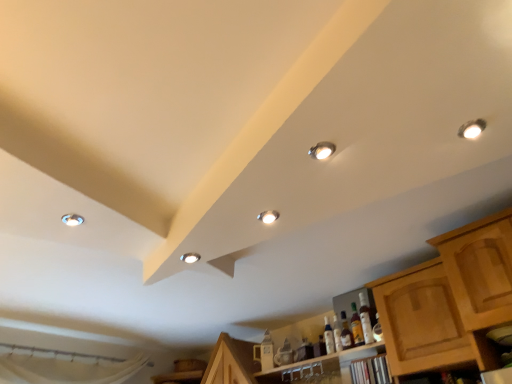
Locate an element on the screen. Image resolution: width=512 pixels, height=384 pixels. matte silver droplight at center, which is the second droplight in top-to-bottom order is located at coordinates (268, 216).

What do you see at coordinates (472, 129) in the screenshot?
I see `matte silver droplight at upper right, the first droplight from the front` at bounding box center [472, 129].

Measure the distance between wooden cabinet at lower right and camera.

wooden cabinet at lower right is 5.08 feet from camera.

Find the location of a particular element. The image size is (512, 384). wooden cabinet at lower right is located at coordinates (450, 300).

This screenshot has width=512, height=384. What do you see at coordinates (356, 326) in the screenshot?
I see `translucent amber bottle at center, which is the 2th bottle in right-to-left order` at bounding box center [356, 326].

What is the approximate width of translucent glass bottle at center, the 1th bottle viewed from the right?

7.25 centimeters.

Where is `clear glass bottle at lower center, the 3th bottle when ordered from right to left`? The height and width of the screenshot is (384, 512). clear glass bottle at lower center, the 3th bottle when ordered from right to left is located at coordinates (328, 337).

Where is `matte silver droplight at center, placed as the 4th droplight when sorted from front to back`? The image size is (512, 384). matte silver droplight at center, placed as the 4th droplight when sorted from front to back is located at coordinates (190, 258).

Where is `matte white droplight at upper left, acting as the 3th droplight starting from the top`? This screenshot has height=384, width=512. matte white droplight at upper left, acting as the 3th droplight starting from the top is located at coordinates (72, 219).

Between clear glass bottle at lower center, acting as the 1th bottle starting from the left, and wooden cabinet at lower right, which one appears on the left side from the viewer's perspective?

clear glass bottle at lower center, acting as the 1th bottle starting from the left.

Locate an element on the screen. The image size is (512, 384). cabinetry on the right of clear glass bottle at lower center, the 3th bottle when ordered from right to left is located at coordinates (450, 300).

Does point (328, 323) lie in front of point (436, 350)?

No, (328, 323) is behind (436, 350).

Can you confirm if wooden cabinet at lower right is shorter than translucent glass bottle at center, the 1th bottle viewed from the right?

No.

How much distance is there between wooden cabinet at lower right and translucent glass bottle at center, which appears as the 3th bottle when viewed from the left?

The distance of wooden cabinet at lower right from translucent glass bottle at center, which appears as the 3th bottle when viewed from the left, is 18.23 inches.

Is the position of wooden cabinet at lower right less distant than that of translucent glass bottle at center, which appears as the 3th bottle when viewed from the left?

Yes, it is in front of translucent glass bottle at center, which appears as the 3th bottle when viewed from the left.

Considering the sizes of wooden cabinet at lower right and translucent glass bottle at center, which appears as the 3th bottle when viewed from the left, in the image, is wooden cabinet at lower right wider or thinner than translucent glass bottle at center, which appears as the 3th bottle when viewed from the left,?

In the image, wooden cabinet at lower right appears to be wider than translucent glass bottle at center, which appears as the 3th bottle when viewed from the left.

Is matte silver droplight at upper right, arranged as the 1th droplight when viewed from the right, looking in the opposite direction of clear glass bottle at lower center, the 3th bottle when ordered from right to left?

No, clear glass bottle at lower center, the 3th bottle when ordered from right to left, is not at the back of matte silver droplight at upper right, arranged as the 1th droplight when viewed from the right.

From a real-world perspective, between matte silver droplight at upper right, placed as the fourth droplight when sorted from left to right, and clear glass bottle at lower center, the 3th bottle when ordered from right to left, who is vertically lower?

clear glass bottle at lower center, the 3th bottle when ordered from right to left.

Is matte silver droplight at upper right, arranged as the fourth droplight when viewed from the back, smaller than clear glass bottle at lower center, the 3th bottle when ordered from right to left?

Indeed, matte silver droplight at upper right, arranged as the fourth droplight when viewed from the back, has a smaller size compared to clear glass bottle at lower center, the 3th bottle when ordered from right to left.

Considering the sizes of objects clear glass bottle at lower center, the 3th bottle when ordered from right to left, and matte silver droplight at center, which ranks as the third droplight in right-to-left order, in the image provided, who is bigger, clear glass bottle at lower center, the 3th bottle when ordered from right to left, or matte silver droplight at center, which ranks as the third droplight in right-to-left order,?

clear glass bottle at lower center, the 3th bottle when ordered from right to left.

Are clear glass bottle at lower center, acting as the 1th bottle starting from the left, and matte silver droplight at center, placed as the 4th droplight when sorted from front to back, beside each other?

No, clear glass bottle at lower center, acting as the 1th bottle starting from the left, is not with matte silver droplight at center, placed as the 4th droplight when sorted from front to back.

Is point (326, 317) in front of point (185, 256)?

No, (326, 317) is further to viewer.

Which is correct: clear glass bottle at lower center, acting as the 1th bottle starting from the left, is inside matte silver droplight at center, the second droplight in the left-to-right sequence, or outside of it?

clear glass bottle at lower center, acting as the 1th bottle starting from the left, lies outside matte silver droplight at center, the second droplight in the left-to-right sequence.

Is translucent amber bottle at center, which is the 2th bottle in right-to-left order, completely or partially inside wooden cabinet at lower right?

No, translucent amber bottle at center, which is the 2th bottle in right-to-left order, is not a part of wooden cabinet at lower right.

Does point (377, 293) come farther from viewer compared to point (352, 316)?

No, (377, 293) is closer to viewer.

Considering the positions of objects wooden cabinet at lower right and translucent amber bottle at center, the 2th bottle positioned from the left, in the image provided, who is behind, wooden cabinet at lower right or translucent amber bottle at center, the 2th bottle positioned from the left,?

translucent amber bottle at center, the 2th bottle positioned from the left, is further away from the camera.

Is matte white droplight at upper left, acting as the 2th droplight starting from the back, bigger than matte silver droplight at upper right, marked as the 1th droplight in a top-to-bottom arrangement?

Incorrect, matte white droplight at upper left, acting as the 2th droplight starting from the back, is not larger than matte silver droplight at upper right, marked as the 1th droplight in a top-to-bottom arrangement.

Does matte white droplight at upper left, acting as the 2th droplight starting from the back, contain matte silver droplight at upper right, arranged as the 1th droplight when viewed from the right?

No, matte silver droplight at upper right, arranged as the 1th droplight when viewed from the right, is not inside matte white droplight at upper left, acting as the 2th droplight starting from the back.

Which is closer to the camera, (72, 217) or (476, 136)?

Point (72, 217) appears to be farther away from the viewer than point (476, 136).

Measure the distance from matte white droplight at upper left, which is the 3th droplight from front to back, to matte silver droplight at upper right, arranged as the fourth droplight when viewed from the back.

matte white droplight at upper left, which is the 3th droplight from front to back, is 1.33 meters away from matte silver droplight at upper right, arranged as the fourth droplight when viewed from the back.

Is the depth of translucent glass bottle at center, which appears as the 3th bottle when viewed from the left, less than that of clear glass bottle at lower center, the 3th bottle when ordered from right to left?

Yes, it is in front of clear glass bottle at lower center, the 3th bottle when ordered from right to left.

Is translucent glass bottle at center, which appears as the 3th bottle when viewed from the left, far away from clear glass bottle at lower center, the 3th bottle when ordered from right to left?

They are positioned close to each other.

From the image's perspective, who appears lower, translucent glass bottle at center, which appears as the 3th bottle when viewed from the left, or clear glass bottle at lower center, the 3th bottle when ordered from right to left?

clear glass bottle at lower center, the 3th bottle when ordered from right to left.

From a real-world perspective, which is physically above, translucent glass bottle at center, the 1th bottle viewed from the right, or clear glass bottle at lower center, acting as the 1th bottle starting from the left?

translucent glass bottle at center, the 1th bottle viewed from the right, is physically above.

Locate an element on the screen. Image resolution: width=512 pixels, height=384 pixels. the 3rd bottle counting from the left of the wooden cabinet at lower right is located at coordinates point(328,337).

Where is `bottle that is the 1st object located below the wooden cabinet at lower right (from the image's perspective)`? bottle that is the 1st object located below the wooden cabinet at lower right (from the image's perspective) is located at coordinates (365, 319).

When comparing their distances from matte silver droplight at upper right, which is the fourth droplight in bottom-to-top order, does wooden cabinet at lower right or translucent glass bottle at center, which appears as the 3th bottle when viewed from the left, seem further?

translucent glass bottle at center, which appears as the 3th bottle when viewed from the left, is positioned further to the anchor matte silver droplight at upper right, which is the fourth droplight in bottom-to-top order.

When comparing their distances from clear glass bottle at lower center, the 3th bottle when ordered from right to left, does matte silver droplight at upper right, which is the fourth droplight in bottom-to-top order, or translucent amber bottle at center, which is the 2th bottle in right-to-left order, seem further?

The object further to clear glass bottle at lower center, the 3th bottle when ordered from right to left, is matte silver droplight at upper right, which is the fourth droplight in bottom-to-top order.

From the image, which object appears to be nearer to matte silver droplight at center, the second droplight in the left-to-right sequence, matte silver droplight at upper right, which is the fourth droplight in bottom-to-top order, or clear glass bottle at lower center, acting as the 1th bottle starting from the left?

The object closer to matte silver droplight at center, the second droplight in the left-to-right sequence, is matte silver droplight at upper right, which is the fourth droplight in bottom-to-top order.

Looking at the image, which one is located closer to matte white droplight at upper left, the second droplight ordered from the bottom, matte silver droplight at center, acting as the second droplight starting from the right, or wooden cabinet at lower right?

matte silver droplight at center, acting as the second droplight starting from the right, is positioned closer to the anchor matte white droplight at upper left, the second droplight ordered from the bottom.

From the image, which object appears to be farther from wooden cabinet at lower right, translucent amber bottle at center, the 2th bottle positioned from the left, or matte silver droplight at center, placed as the 4th droplight when sorted from front to back?

matte silver droplight at center, placed as the 4th droplight when sorted from front to back, is further to wooden cabinet at lower right.

From the image, which object appears to be farther from matte silver droplight at center, arranged as the first droplight when ordered from the bottom, wooden cabinet at lower right or clear glass bottle at lower center, the 3th bottle when ordered from right to left?

clear glass bottle at lower center, the 3th bottle when ordered from right to left, lies further to matte silver droplight at center, arranged as the first droplight when ordered from the bottom, than the other object.

Which object lies nearer to the anchor point translucent glass bottle at center, which appears as the 3th bottle when viewed from the left, wooden cabinet at lower right or matte silver droplight at upper right, the first droplight from the front?

wooden cabinet at lower right is closer to translucent glass bottle at center, which appears as the 3th bottle when viewed from the left.

From the image, which object appears to be farther from matte silver droplight at upper right, the first droplight from the front, matte white droplight at upper left, acting as the 3th droplight starting from the top, or clear glass bottle at lower center, acting as the 1th bottle starting from the left?

Among the two, clear glass bottle at lower center, acting as the 1th bottle starting from the left, is located further to matte silver droplight at upper right, the first droplight from the front.

Where is `bottle between clear glass bottle at lower center, the 3th bottle when ordered from right to left, and translucent glass bottle at center, which appears as the 3th bottle when viewed from the left, from left to right`? bottle between clear glass bottle at lower center, the 3th bottle when ordered from right to left, and translucent glass bottle at center, which appears as the 3th bottle when viewed from the left, from left to right is located at coordinates (356, 326).

Image resolution: width=512 pixels, height=384 pixels. Find the location of `cabinetry between matte silver droplight at upper right, arranged as the 1th droplight when viewed from the right, and translucent amber bottle at center, the 2th bottle positioned from the left, in the front-back direction`. cabinetry between matte silver droplight at upper right, arranged as the 1th droplight when viewed from the right, and translucent amber bottle at center, the 2th bottle positioned from the left, in the front-back direction is located at coordinates click(450, 300).

Locate an element on the screen. This screenshot has width=512, height=384. cabinetry between matte silver droplight at upper right, arranged as the 1th droplight when viewed from the right, and clear glass bottle at lower center, the 3th bottle when ordered from right to left, along the z-axis is located at coordinates (450, 300).

The height and width of the screenshot is (384, 512). What are the coordinates of `cabinetry between matte silver droplight at center, which is the 3th droplight from back to front, and translucent amber bottle at center, the 2th bottle positioned from the left, along the z-axis` in the screenshot? It's located at (450, 300).